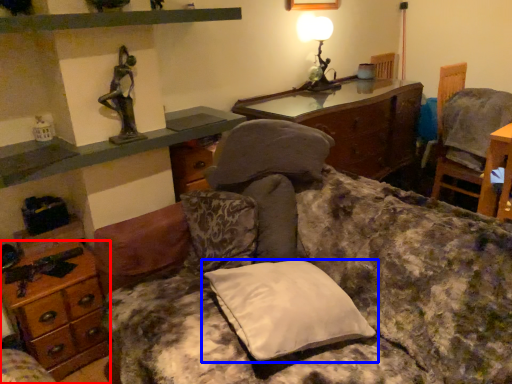
Question: Which object is further to the camera taking this photo, desk (highlighted by a red box) or pillow (highlighted by a blue box)?

Choices:
 (A) desk
 (B) pillow

Answer: (A)